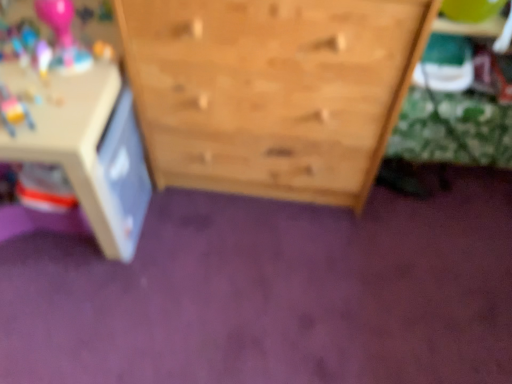
Measure the distance between white plastic table at left and camera.

white plastic table at left is 84.70 centimeters from camera.

What do you see at coordinates (87, 147) in the screenshot? This screenshot has width=512, height=384. I see `white plastic table at left` at bounding box center [87, 147].

The width and height of the screenshot is (512, 384). Identify the location of white plastic table at left. (87, 147).

The width and height of the screenshot is (512, 384). What do you see at coordinates (271, 91) in the screenshot? I see `natural wood chest of drawers at center` at bounding box center [271, 91].

What is the approximate width of natural wood chest of drawers at center?

The width of natural wood chest of drawers at center is 14.33 inches.

At what (x,y) coordinates should I click in order to perform the action: click on natural wood chest of drawers at center. Please return your answer as a coordinate pair (x, y). This screenshot has width=512, height=384. Looking at the image, I should click on (271, 91).

Locate an element on the screen. The width and height of the screenshot is (512, 384). white plastic table at left is located at coordinates (87, 147).

Is white plastic table at left to the right of natural wood chest of drawers at center from the viewer's perspective?

In fact, white plastic table at left is to the left of natural wood chest of drawers at center.

Between white plastic table at left and natural wood chest of drawers at center, which one is positioned behind?

white plastic table at left.

Which is in front, point (140, 192) or point (323, 164)?

Positioned in front is point (323, 164).

From the image's perspective, is white plastic table at left located beneath natural wood chest of drawers at center?

Yes.

From a real-world perspective, relative to natural wood chest of drawers at center, is white plastic table at left vertically above or below?

In terms of real-world spatial position, white plastic table at left is below natural wood chest of drawers at center.

Is white plastic table at left thinner than natural wood chest of drawers at center?

No.

Who is shorter, white plastic table at left or natural wood chest of drawers at center?

With less height is white plastic table at left.

Looking at the image, does white plastic table at left seem bigger or smaller compared to natural wood chest of drawers at center?

Clearly, white plastic table at left is smaller in size than natural wood chest of drawers at center.

Is white plastic table at left not inside natural wood chest of drawers at center?

Yes, white plastic table at left is located beyond the bounds of natural wood chest of drawers at center.

Is white plastic table at left next to natural wood chest of drawers at center?

They are not placed beside each other.

Is white plastic table at left facing towards natural wood chest of drawers at center?

No, white plastic table at left is not facing towards natural wood chest of drawers at center.

Locate an element on the screen. The image size is (512, 384). table that is on the left side of natural wood chest of drawers at center is located at coordinates (87, 147).

Between natural wood chest of drawers at center and white plastic table at left, which one appears on the right side from the viewer's perspective?

Positioned to the right is natural wood chest of drawers at center.

Is natural wood chest of drawers at center in front of white plastic table at left?

That is True.

Does point (254, 137) come in front of point (137, 219)?

Yes, it is.

From the image's perspective, which one is positioned higher, natural wood chest of drawers at center or white plastic table at left?

natural wood chest of drawers at center.

From a real-world perspective, who is located lower, natural wood chest of drawers at center or white plastic table at left?

white plastic table at left.

Is natural wood chest of drawers at center wider than white plastic table at left?

In fact, natural wood chest of drawers at center might be narrower than white plastic table at left.

Considering the relative sizes of natural wood chest of drawers at center and white plastic table at left in the image provided, is natural wood chest of drawers at center shorter than white plastic table at left?

No, natural wood chest of drawers at center is not shorter than white plastic table at left.

Who is smaller, natural wood chest of drawers at center or white plastic table at left?

white plastic table at left is smaller.

Would you say natural wood chest of drawers at center contains white plastic table at left?

No.

Is the surface of natural wood chest of drawers at center in direct contact with white plastic table at left?

No.

Is natural wood chest of drawers at center looking in the opposite direction of white plastic table at left?

No, natural wood chest of drawers at center's orientation is not away from white plastic table at left.

How much distance is there between natural wood chest of drawers at center and white plastic table at left?

The distance of natural wood chest of drawers at center from white plastic table at left is 10.65 inches.

Find the location of `the chest of drawers that is above the white plastic table at left (from the image's perspective)`. the chest of drawers that is above the white plastic table at left (from the image's perspective) is located at coordinates (271, 91).

Where is `table on the left of the natural wood chest of drawers at center`? The width and height of the screenshot is (512, 384). table on the left of the natural wood chest of drawers at center is located at coordinates (87, 147).

Where is `table that appears behind the natural wood chest of drawers at center`? The width and height of the screenshot is (512, 384). table that appears behind the natural wood chest of drawers at center is located at coordinates (87, 147).